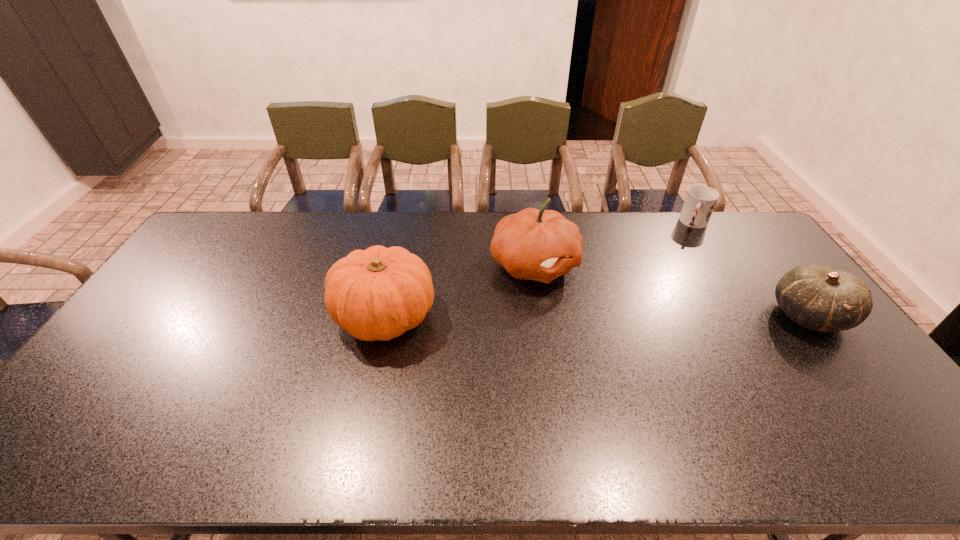
Find the location of a particular element. The image size is (960, 540). object that is the second nearest to the third tallest object is located at coordinates (541, 245).

At what (x,y) coordinates should I click in order to perform the action: click on vacant region that satisfies the following two spatial constraints: 1. on the back side of the third object from left to right; 2. on the left side of the right pumpkin. Please return your answer as a coordinate pair (x, y). This screenshot has width=960, height=540. Looking at the image, I should click on (529, 223).

What are the coordinates of `vacant space that satisfies the following two spatial constraints: 1. on the back side of the right pumpkin; 2. on the left side of the shortest object` in the screenshot? It's located at (529, 223).